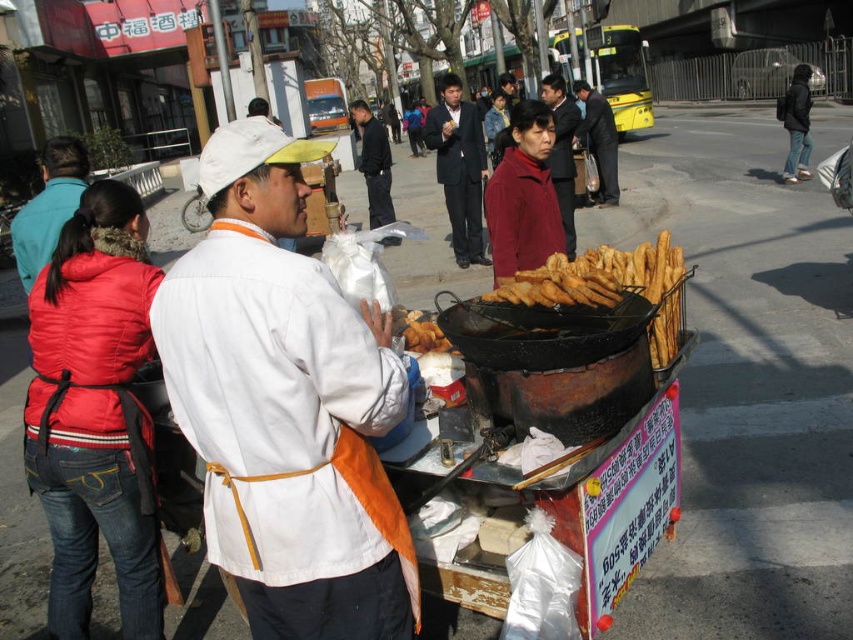
Question: Which object is positioned closest to the golden crispy fried dough at center?

Choices:
 (A) dark brown leather jacket at center
 (B) dark blue suit at center
 (C) white fabric jacket at center

Answer: (C)

Question: Does white fabric jacket at center have a smaller size compared to matte red jacket at center?

Choices:
 (A) no
 (B) yes

Answer: (A)

Question: Among these objects, which one is nearest to the camera?

Choices:
 (A) dark blue suit at center
 (B) golden crispy fried dough at center
 (C) maroon fabric jacket at center

Answer: (B)

Question: Where is dark gray suit at center located in relation to dark brown leather jacket at center in the image?

Choices:
 (A) right
 (B) left

Answer: (B)

Question: Is matte red jacket at center in front of maroon fabric jacket at center?

Choices:
 (A) yes
 (B) no

Answer: (A)

Question: Estimate the real-world distances between objects in this image. Which object is closer to the maroon fabric jacket at center?

Choices:
 (A) dark gray suit at center
 (B) matte red jacket at center
 (C) dark brown leather jacket at center
 (D) golden crispy fried dough at center

Answer: (C)